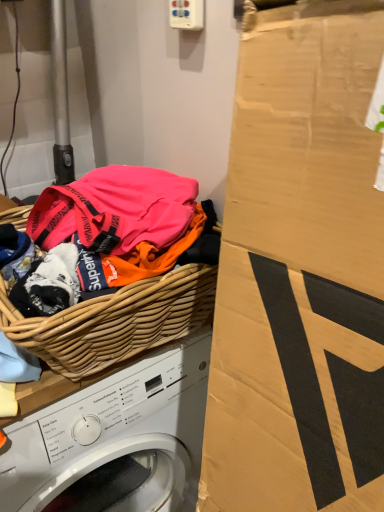
Question: Is white woven basket at upper left closer to the viewer compared to woven wood basket at left?

Choices:
 (A) yes
 (B) no

Answer: (B)

Question: From the image's perspective, would you say white woven basket at upper left is positioned over woven wood basket at left?

Choices:
 (A) no
 (B) yes

Answer: (A)

Question: From a real-world perspective, is white woven basket at upper left over woven wood basket at left?

Choices:
 (A) yes
 (B) no

Answer: (B)

Question: Is white woven basket at upper left completely or partially outside of woven wood basket at left?

Choices:
 (A) no
 (B) yes

Answer: (B)

Question: Is white woven basket at upper left facing towards woven wood basket at left?

Choices:
 (A) no
 (B) yes

Answer: (A)

Question: From a real-world perspective, is white woven basket at upper left positioned under woven wood basket at left based on gravity?

Choices:
 (A) no
 (B) yes

Answer: (B)

Question: Is white woven basket at upper left a part of woven wood basket at left?

Choices:
 (A) no
 (B) yes

Answer: (A)

Question: Is woven wood basket at left outside of white woven basket at upper left?

Choices:
 (A) yes
 (B) no

Answer: (A)

Question: Can you confirm if woven wood basket at left is smaller than white woven basket at upper left?

Choices:
 (A) no
 (B) yes

Answer: (B)

Question: Considering the relative positions of woven wood basket at left and white woven basket at upper left in the image provided, is woven wood basket at left to the left of white woven basket at upper left from the viewer's perspective?

Choices:
 (A) yes
 (B) no

Answer: (B)

Question: Is woven wood basket at left positioned with its back to white woven basket at upper left?

Choices:
 (A) no
 (B) yes

Answer: (A)

Question: Is woven wood basket at left far away from white woven basket at upper left?

Choices:
 (A) no
 (B) yes

Answer: (A)

Question: Looking at their shapes, would you say woven wood basket at left is wider or thinner than white woven basket at upper left?

Choices:
 (A) thin
 (B) wide

Answer: (A)